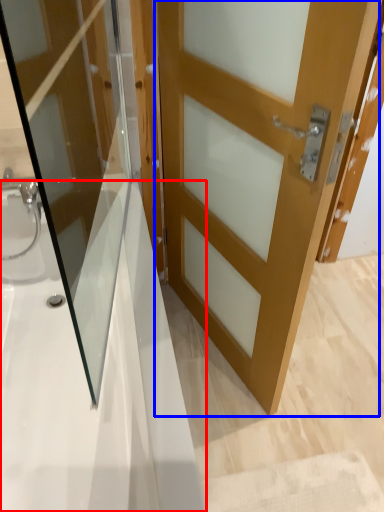
Question: Which point is closer to the camera, bath (highlighted by a red box) or door (highlighted by a blue box)?

Choices:
 (A) bath
 (B) door

Answer: (A)